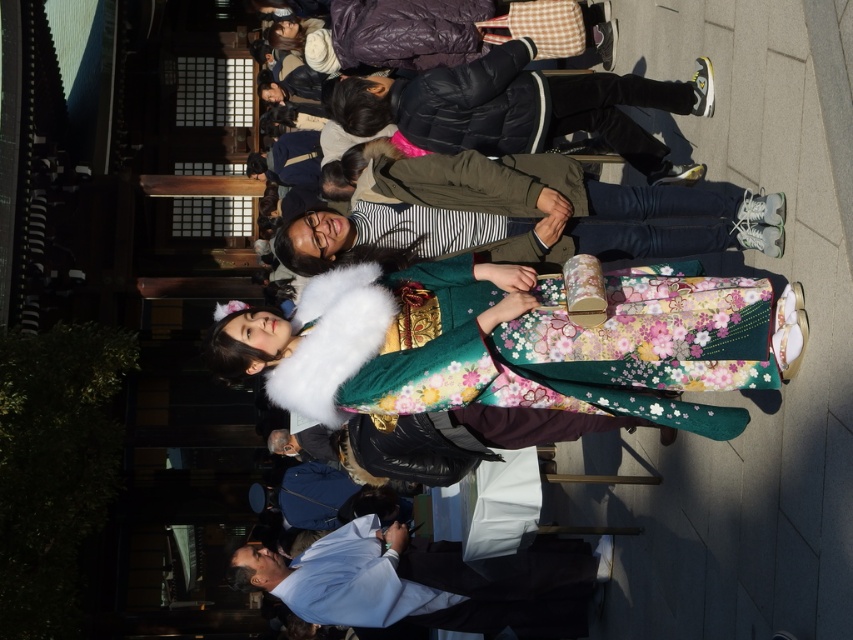
Between fluffy white kimono at center and striped fabric shirt at center, which one is positioned lower?

Positioned lower is striped fabric shirt at center.

Is point (706, 113) farther from camera compared to point (720, 225)?

Yes.

Locate an element on the screen. The image size is (853, 640). fluffy white kimono at center is located at coordinates (520, 108).

Who is more distant from viewer, [670,289] or [289,264]?

Positioned behind is point [289,264].

Does floral silk kimono at center have a larger size compared to striped fabric shirt at center?

Yes.

Locate an element on the screen. floral silk kimono at center is located at coordinates (508, 346).

Where is `floral silk kimono at center`? floral silk kimono at center is located at coordinates (508, 346).

Which is more to the left, floral silk kimono at center or fluffy white kimono at center?

floral silk kimono at center is more to the left.

Is point (741, 413) farther from viewer compared to point (424, 136)?

No, (741, 413) is in front of (424, 136).

At what (x,y) coordinates should I click in order to perform the action: click on floral silk kimono at center. Please return your answer as a coordinate pair (x, y). This screenshot has height=640, width=853. Looking at the image, I should click on (508, 346).

This screenshot has height=640, width=853. I want to click on floral silk kimono at center, so click(508, 346).